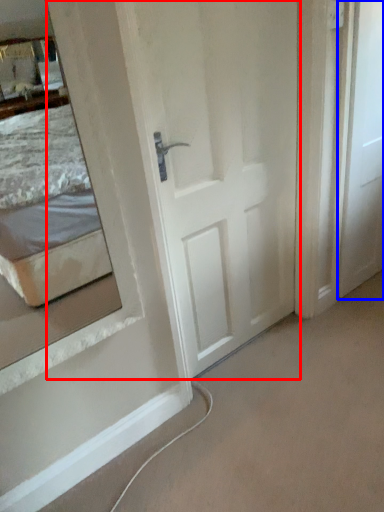
Question: Which of the following is the closest to the observer, door (highlighted by a red box) or door (highlighted by a blue box)?

Choices:
 (A) door
 (B) door

Answer: (A)